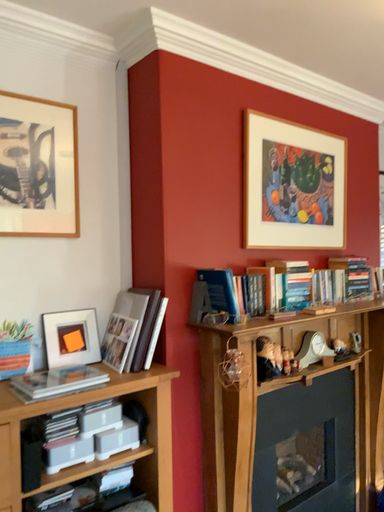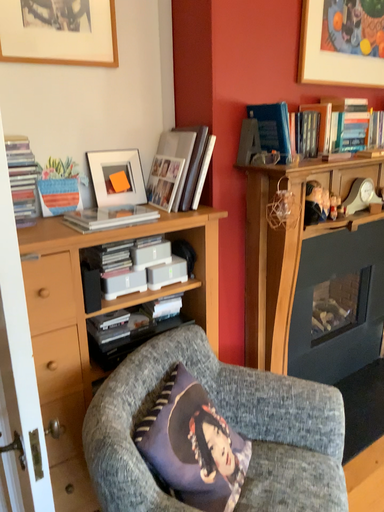
Question: Which way did the camera rotate in the video?

Choices:
 (A) rotated downward
 (B) rotated upward

Answer: (A)